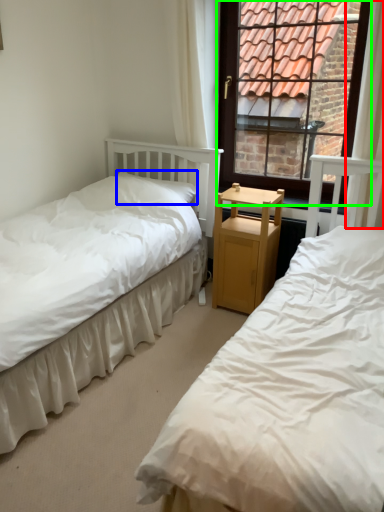
Question: Which object is the closest to the curtain (highlighted by a red box)? Choose among these: pillow (highlighted by a blue box) or window (highlighted by a green box).

Choices:
 (A) pillow
 (B) window

Answer: (A)